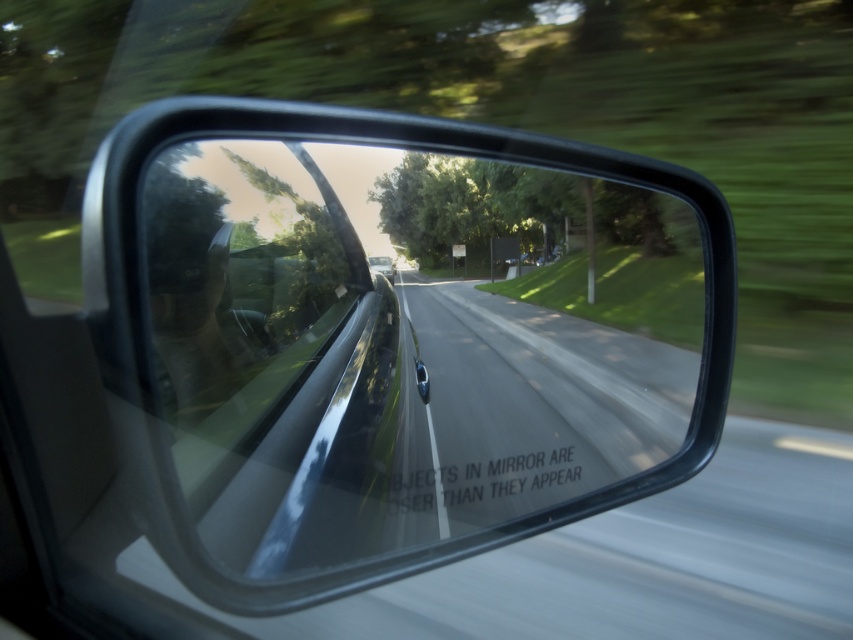
Does glossy metallic mirror at center have a lesser height compared to metallic silver car at center?

No, glossy metallic mirror at center is not shorter than metallic silver car at center.

Who is positioned more to the right, glossy metallic mirror at center or metallic silver car at center?

From the viewer's perspective, glossy metallic mirror at center appears more on the right side.

Does point (219, 376) come behind point (389, 268)?

No.

Locate an element on the screen. Image resolution: width=853 pixels, height=640 pixels. glossy metallic mirror at center is located at coordinates (407, 342).

Is asphalt road at center positioned before metallic silver car at center?

Yes, it is in front of metallic silver car at center.

Which is below, asphalt road at center or metallic silver car at center?

asphalt road at center is below.

Where is `asphalt road at center`? asphalt road at center is located at coordinates pyautogui.click(x=538, y=400).

Image resolution: width=853 pixels, height=640 pixels. Identify the location of asphalt road at center. (538, 400).

Is glossy metallic mirror at center shorter than asphalt road at center?

In fact, glossy metallic mirror at center may be taller than asphalt road at center.

Locate an element on the screen. glossy metallic mirror at center is located at coordinates (407, 342).